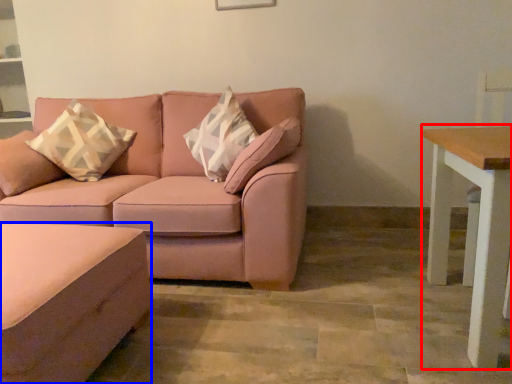
Question: Which of the following is the closest to the observer, table (highlighted by a red box) or footrest (highlighted by a blue box)?

Choices:
 (A) table
 (B) footrest

Answer: (B)